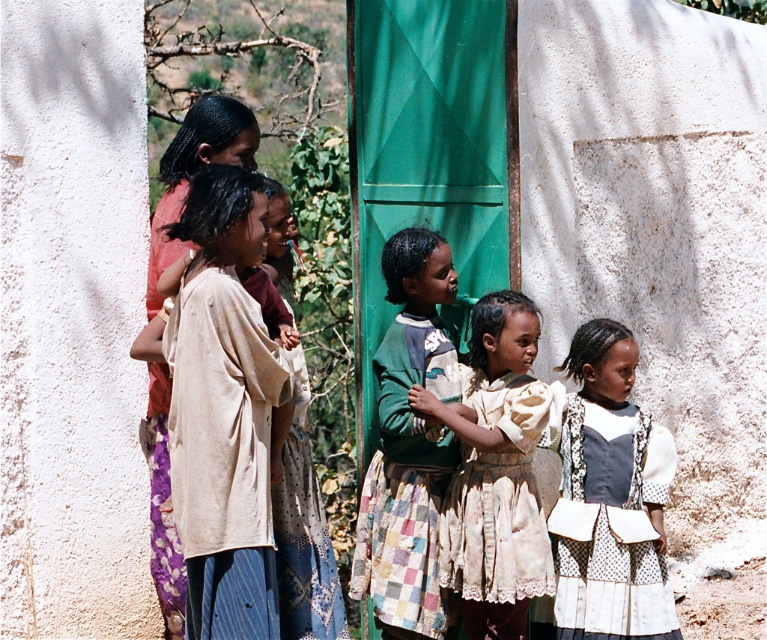
Does multicolored patchwork skirt at center appear on the right side of beige fabric dress at left?

Correct, you'll find multicolored patchwork skirt at center to the right of beige fabric dress at left.

You are a GUI agent. You are given a task and a screenshot of the screen. Output one action in this format:
    pyautogui.click(x=<x>, y=<y>)
    Task: Click on the multicolored patchwork skirt at center
    The image size is (767, 640).
    Given the screenshot: What is the action you would take?
    pyautogui.click(x=407, y=442)

Between point (439, 364) and point (180, 244), which one is positioned behind?

The point (439, 364) is behind.

The width and height of the screenshot is (767, 640). Identify the location of multicolored patchwork skirt at center. (407, 442).

Who is positioned more to the left, light beige lace dress at center or beige fabric dress at left?

From the viewer's perspective, beige fabric dress at left appears more on the left side.

Can you confirm if light beige lace dress at center is positioned to the left of beige fabric dress at left?

No, light beige lace dress at center is not to the left of beige fabric dress at left.

I want to click on light beige lace dress at center, so click(495, 472).

Between white dotted dress at center and light beige lace dress at center, which one appears on the left side from the viewer's perspective?

Positioned to the left is light beige lace dress at center.

Is white dotted dress at center closer to the viewer compared to light beige lace dress at center?

That is False.

Find the location of a particular element. The width and height of the screenshot is (767, 640). white dotted dress at center is located at coordinates (607, 497).